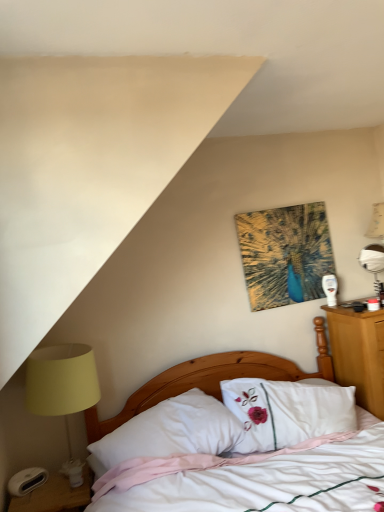
Measure the distance between point (362, 255) and camera.

2.76 meters.

This screenshot has height=512, width=384. What do you see at coordinates (373, 262) in the screenshot?
I see `metallic silver table lamp at right` at bounding box center [373, 262].

Describe the element at coordinates (170, 432) in the screenshot. I see `white soft pillow at center` at that location.

The image size is (384, 512). Describe the element at coordinates (56, 495) in the screenshot. I see `white glossy nightstand at lower left` at that location.

The image size is (384, 512). I want to click on matte yellow lampshade at left, so click(x=63, y=389).

From a real-world perspective, is white soft pillow at center physically located above or below matte yellow lampshade at left?

white soft pillow at center is below matte yellow lampshade at left.

Is white soft pillow at center not near matte yellow lampshade at left?

That's not correct — white soft pillow at center is a little close to matte yellow lampshade at left.

Is white soft pillow at center to the right of matte yellow lampshade at left from the viewer's perspective?

Yes, white soft pillow at center is to the right of matte yellow lampshade at left.

What's the angular difference between white soft pillow at center and matte yellow lampshade at left's facing directions?

The angle between the facing direction of white soft pillow at center and the facing direction of matte yellow lampshade at left is 10 degrees.

From the image's perspective, which object appears higher, white soft pillow at center or white matte bed at center?

white soft pillow at center.

Which object is positioned more to the right, white soft pillow at center or white matte bed at center?

Positioned to the right is white matte bed at center.

Can white matte bed at center be found inside white soft pillow at center?

No.

Does point (180, 432) lie behind point (198, 385)?

No, it is not.

Considering the sizes of objects abstract painting at upper center and white soft pillow at center in the image provided, who is wider, abstract painting at upper center or white soft pillow at center?

white soft pillow at center.

Is abstract painting at upper center positioned far away from white soft pillow at center?

abstract painting at upper center is actually quite close to white soft pillow at center.

Would you say abstract painting at upper center is inside or outside white soft pillow at center?

abstract painting at upper center cannot be found inside white soft pillow at center.

Is white soft pillow at center surrounding metallic silver table lamp at right?

Definitely not — metallic silver table lamp at right is not inside white soft pillow at center.

Is white soft pillow at center not close to metallic silver table lamp at right?

white soft pillow at center is far away from metallic silver table lamp at right.

Find the location of a particular element. Image resolution: width=384 pixels, height=512 pixels. pillow in front of the metallic silver table lamp at right is located at coordinates (170, 432).

Is white soft pillow at center turned away from metallic silver table lamp at right?

No, white soft pillow at center is not facing the opposite direction of metallic silver table lamp at right.

How different are the orientations of white glossy nightstand at lower left and abstract painting at upper center in degrees?

The angular difference between white glossy nightstand at lower left and abstract painting at upper center is 1.06 degrees.

From the image's perspective, which one is positioned lower, white glossy nightstand at lower left or abstract painting at upper center?

white glossy nightstand at lower left is shown below in the image.

Can you confirm if white glossy nightstand at lower left is wider than abstract painting at upper center?

Yes.

From a real-world perspective, is white glossy nightstand at lower left beneath abstract painting at upper center?

Yes.

Is metallic silver table lamp at right to the left of white glossy nightstand at lower left from the viewer's perspective?

No, metallic silver table lamp at right is not to the left of white glossy nightstand at lower left.

What's the angular difference between metallic silver table lamp at right and white glossy nightstand at lower left's facing directions?

The angular difference between metallic silver table lamp at right and white glossy nightstand at lower left is 2.47 degrees.

Which of these two, metallic silver table lamp at right or white glossy nightstand at lower left, is thinner?

metallic silver table lamp at right is thinner.

Is metallic silver table lamp at right aimed at white glossy nightstand at lower left?

No.

In terms of width, does white glossy nightstand at lower left look wider or thinner when compared to white matte bed at center?

Considering their sizes, white glossy nightstand at lower left looks slimmer than white matte bed at center.

Between white glossy nightstand at lower left and white matte bed at center, which one appears on the right side from the viewer's perspective?

white matte bed at center is more to the right.

This screenshot has width=384, height=512. Identify the location of bed above the white glossy nightstand at lower left (from the image's perspective). (211, 379).

You are a GUI agent. You are given a task and a screenshot of the screen. Output one action in this format:
    pyautogui.click(x=<x>, y=<y>)
    Task: Click on the bedside lamp behind the white soft pillow at center
    The width and height of the screenshot is (384, 512).
    Given the screenshot: What is the action you would take?
    pyautogui.click(x=63, y=389)

At what (x,y) coordinates should I click in order to perform the action: click on pillow that appears on the left of white matte bed at center. Please return your answer as a coordinate pair (x, y). The width and height of the screenshot is (384, 512). Looking at the image, I should click on (170, 432).

Based on their spatial positions, is metallic silver table lamp at right or white glossy nightstand at lower left further from abstract painting at upper center?

white glossy nightstand at lower left lies further to abstract painting at upper center than the other object.

Based on the photo, estimate the real-world distances between objects in this image. Which object is further from white matte bed at center, abstract painting at upper center or white soft pillow at center?

Based on the image, abstract painting at upper center appears to be further to white matte bed at center.

In the scene shown: Looking at the image, which one is located closer to white glossy nightstand at lower left, metallic silver table lamp at right or abstract painting at upper center?

The object closer to white glossy nightstand at lower left is abstract painting at upper center.

Estimate the real-world distances between objects in this image. Which object is further from metallic silver table lamp at right, white matte bed at center or matte yellow lampshade at left?

Based on the image, matte yellow lampshade at left appears to be further to metallic silver table lamp at right.

From the image, which object appears to be nearer to metallic silver table lamp at right, white matte bed at center or abstract painting at upper center?

Based on the image, abstract painting at upper center appears to be nearer to metallic silver table lamp at right.

Based on the photo, when comparing their distances from abstract painting at upper center, does matte yellow lampshade at left or white soft pillow at center seem closer?

The object closer to abstract painting at upper center is white soft pillow at center.

Which object lies further to the anchor point white matte bed at center, abstract painting at upper center or white glossy nightstand at lower left?

Based on the image, white glossy nightstand at lower left appears to be further to white matte bed at center.

Estimate the real-world distances between objects in this image. Which object is further from white matte bed at center, metallic silver table lamp at right or abstract painting at upper center?

metallic silver table lamp at right.

You are a GUI agent. You are given a task and a screenshot of the screen. Output one action in this format:
    pyautogui.click(x=<x>, y=<y>)
    Task: Click on the pillow between matte yellow lampshade at left and metallic silver table lamp at right
    The width and height of the screenshot is (384, 512).
    Given the screenshot: What is the action you would take?
    pyautogui.click(x=170, y=432)

Locate an element on the screen. pillow located between white matte bed at center and matte yellow lampshade at left in the depth direction is located at coordinates (170, 432).

The height and width of the screenshot is (512, 384). In order to click on picture frame between white glossy nightstand at lower left and metallic silver table lamp at right in the horizontal direction in this screenshot , I will do `click(285, 254)`.

You are a GUI agent. You are given a task and a screenshot of the screen. Output one action in this format:
    pyautogui.click(x=<x>, y=<y>)
    Task: Click on the nightstand between white matte bed at center and abstract painting at upper center in the front-back direction
    
    Given the screenshot: What is the action you would take?
    pyautogui.click(x=56, y=495)